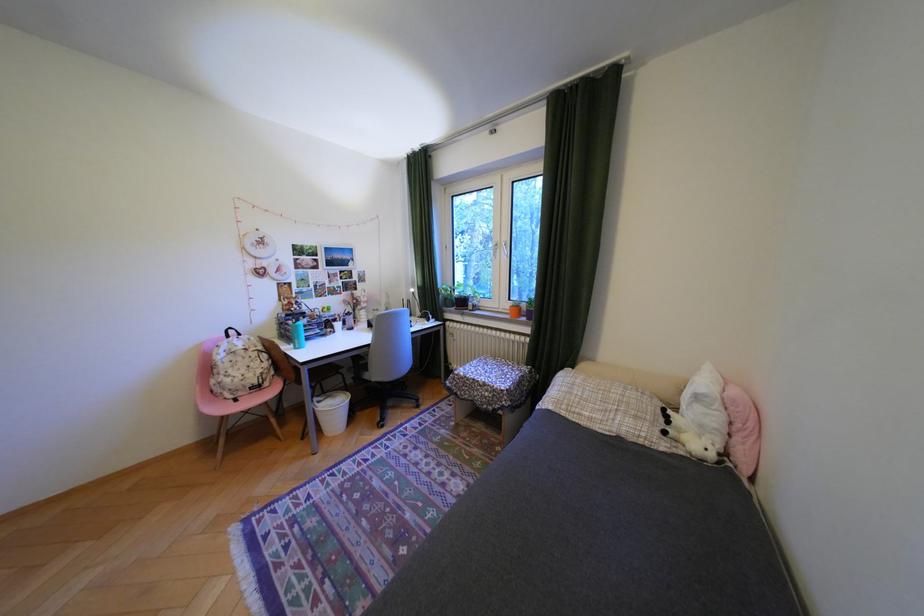
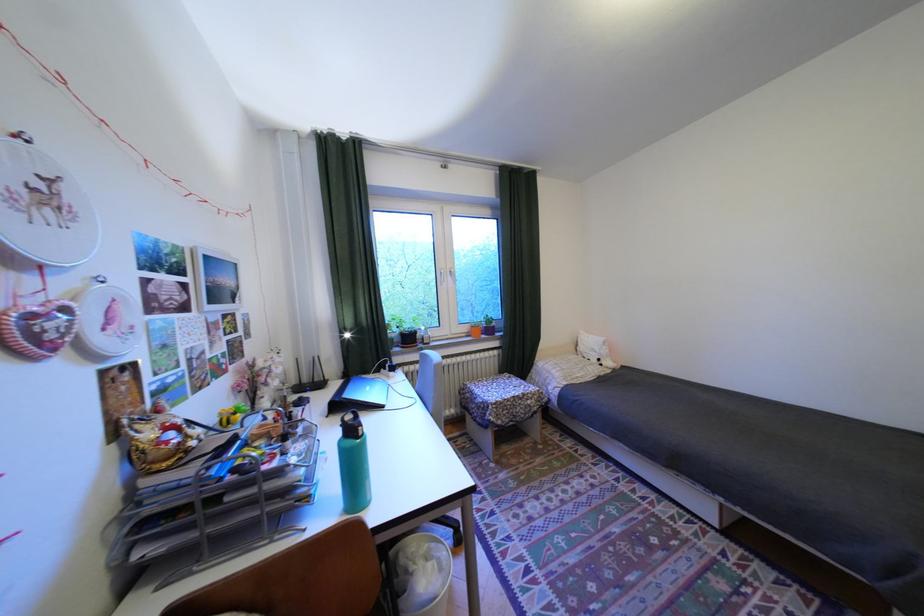
Find the pixel in the second image that matches [273,243] in the first image.

(58, 197)